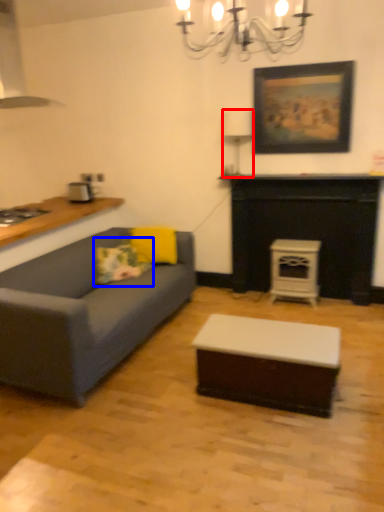
Question: Which object is further to the camera taking this photo, lamp (highlighted by a red box) or pillow (highlighted by a blue box)?

Choices:
 (A) lamp
 (B) pillow

Answer: (A)